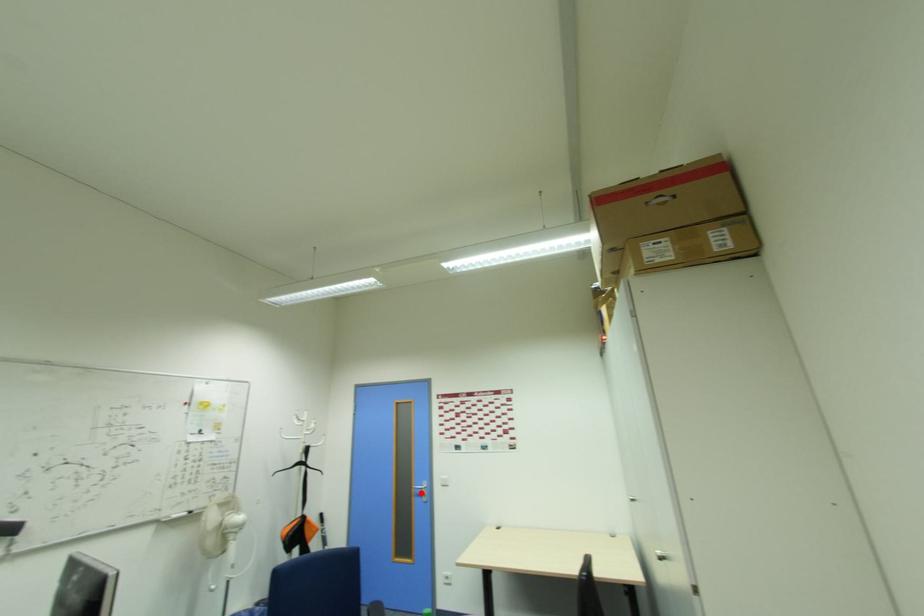
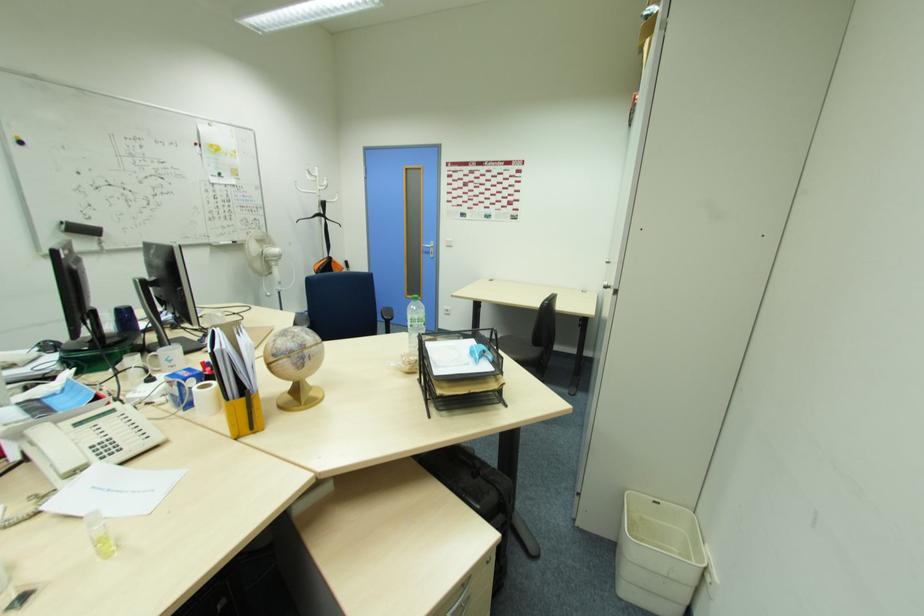
Question: I am providing you with two images of the same scene from different viewpoints. Given a red point in image1, look at the same physical point in image2. Is it:

Choices:
 (A) Closer to the viewpoint
 (B) Farther from the viewpoint

Answer: (A)